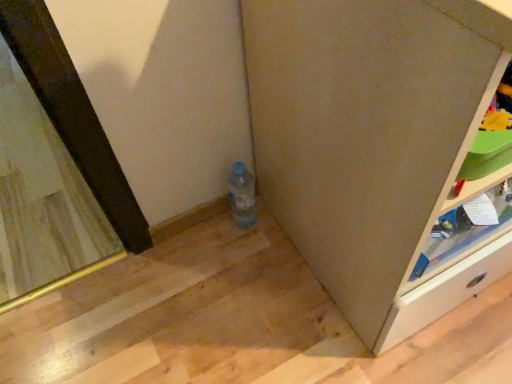
Question: Can you see light brown wooden shelf at right touching matte gray cabinet at lower right?

Choices:
 (A) no
 (B) yes

Answer: (A)

Question: Is light brown wooden shelf at right looking in the opposite direction of matte gray cabinet at lower right?

Choices:
 (A) no
 (B) yes

Answer: (B)

Question: Is light brown wooden shelf at right behind matte gray cabinet at lower right?

Choices:
 (A) no
 (B) yes

Answer: (B)

Question: Could you tell me if light brown wooden shelf at right is facing matte gray cabinet at lower right?

Choices:
 (A) no
 (B) yes

Answer: (B)

Question: Can you confirm if light brown wooden shelf at right is wider than matte gray cabinet at lower right?

Choices:
 (A) no
 (B) yes

Answer: (A)

Question: From a real-world perspective, does light brown wooden shelf at right stand above matte gray cabinet at lower right?

Choices:
 (A) no
 (B) yes

Answer: (A)

Question: From a real-world perspective, is matte gray cabinet at lower right positioned under wooden frame mirror at left based on gravity?

Choices:
 (A) yes
 (B) no

Answer: (B)

Question: Does matte gray cabinet at lower right turn towards wooden frame mirror at left?

Choices:
 (A) no
 (B) yes

Answer: (A)

Question: Is matte gray cabinet at lower right at the right side of wooden frame mirror at left?

Choices:
 (A) yes
 (B) no

Answer: (A)

Question: Is the depth of matte gray cabinet at lower right less than that of wooden frame mirror at left?

Choices:
 (A) no
 (B) yes

Answer: (B)

Question: From the image's perspective, is matte gray cabinet at lower right above wooden frame mirror at left?

Choices:
 (A) no
 (B) yes

Answer: (A)

Question: From the image's perspective, is matte gray cabinet at lower right under wooden frame mirror at left?

Choices:
 (A) yes
 (B) no

Answer: (A)

Question: Is light brown wooden shelf at right thinner than wooden frame mirror at left?

Choices:
 (A) no
 (B) yes

Answer: (B)